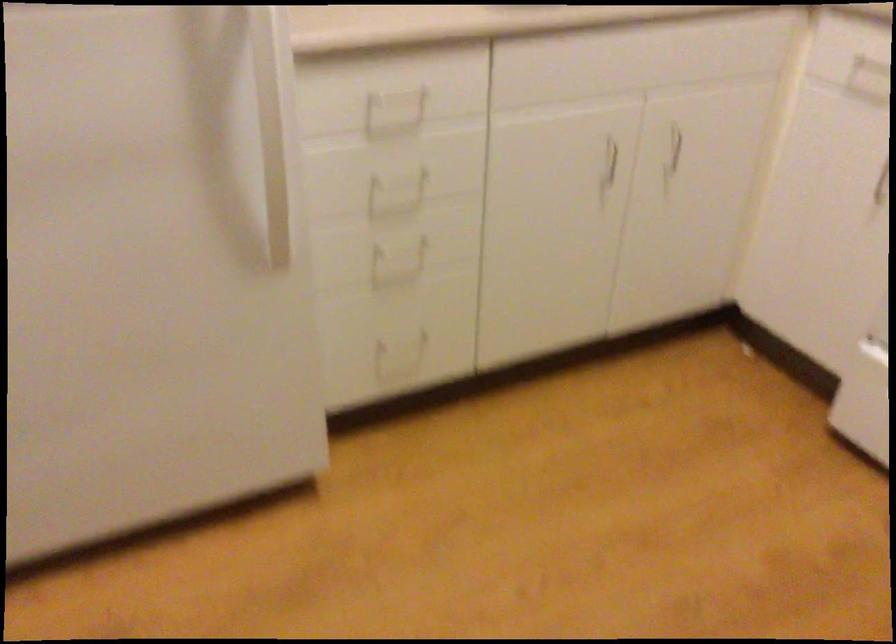
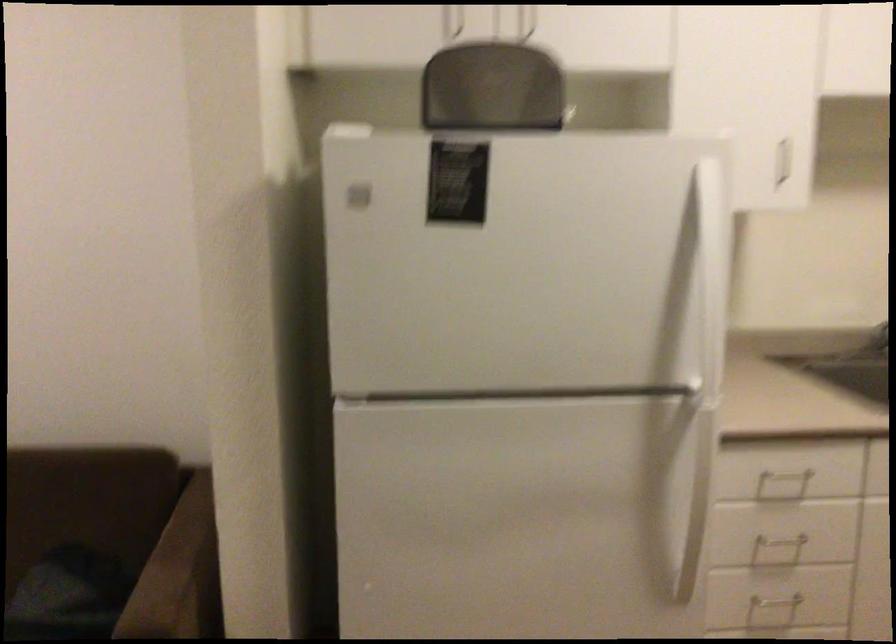
The point at (261, 134) is marked in the first image. Where is the corresponding point in the second image?

(687, 495)